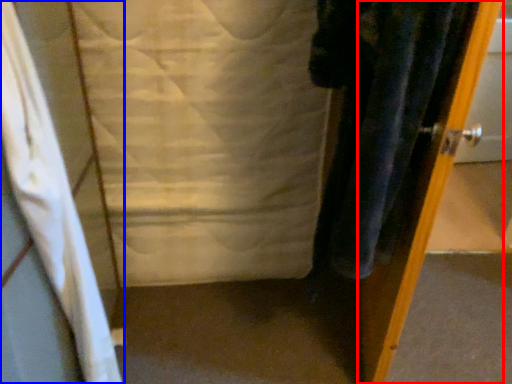
Question: Which object appears farthest to the camera in this image, door (highlighted by a red box) or curtain (highlighted by a blue box)?

Choices:
 (A) door
 (B) curtain

Answer: (A)